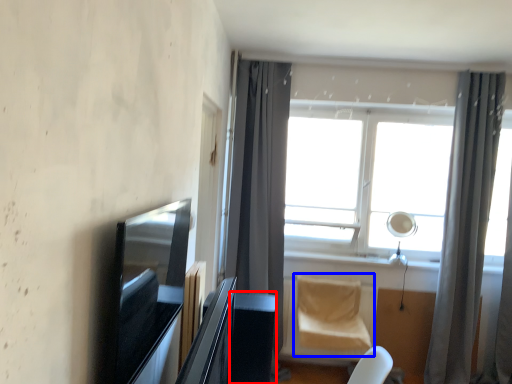
Question: Among these objects, which one is nearest to the camera, table (highlighted by a red box) or swivel chair (highlighted by a blue box)?

Choices:
 (A) table
 (B) swivel chair

Answer: (A)